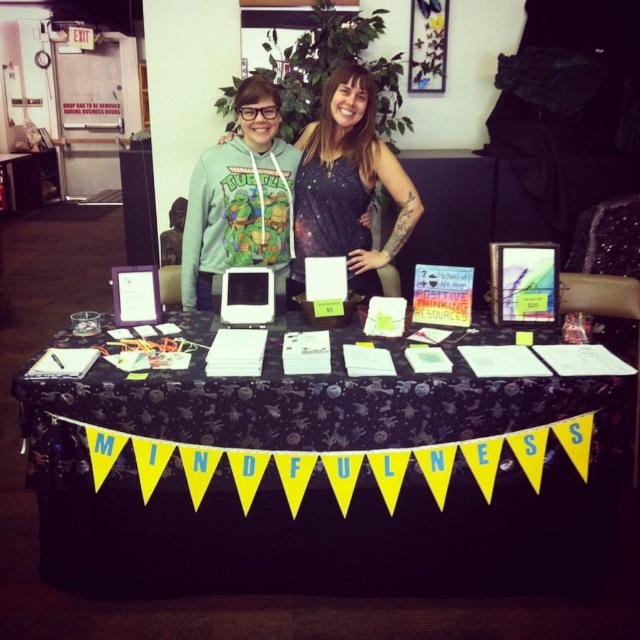
Can you confirm if black fabric table at center is taller than black galaxy print dress at center?

Yes.

From the picture: Between black fabric table at center and black galaxy print dress at center, which one has less height?

Standing shorter between the two is black galaxy print dress at center.

Is point (237, 378) positioned behind point (317, 161)?

No, it is in front of (317, 161).

Find the location of `black fabric table at center`. black fabric table at center is located at coordinates (323, 483).

Is teal fabric hoodie at center positioned in front of black galaxy print dress at center?

Yes, it is in front of black galaxy print dress at center.

Can you confirm if teal fabric hoodie at center is positioned below black galaxy print dress at center?

Incorrect, teal fabric hoodie at center is not positioned below black galaxy print dress at center.

Between point (365, 125) and point (332, 177), which one is positioned in front?

Positioned in front is point (332, 177).

Find the location of a particular element. teal fabric hoodie at center is located at coordinates (348, 180).

Is black fabric table at center positioned before teal fabric hoodie at center?

Yes.

Who is positioned more to the right, black fabric table at center or teal fabric hoodie at center?

Positioned to the right is teal fabric hoodie at center.

Is point (97, 502) behind point (321, 173)?

No.

In order to click on black fabric table at center in this screenshot , I will do `click(323, 483)`.